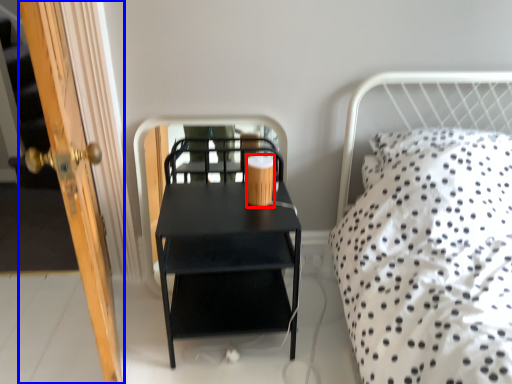
Question: Which object is closer to the camera taking this photo, coffee cup (highlighted by a red box) or door (highlighted by a blue box)?

Choices:
 (A) coffee cup
 (B) door

Answer: (B)